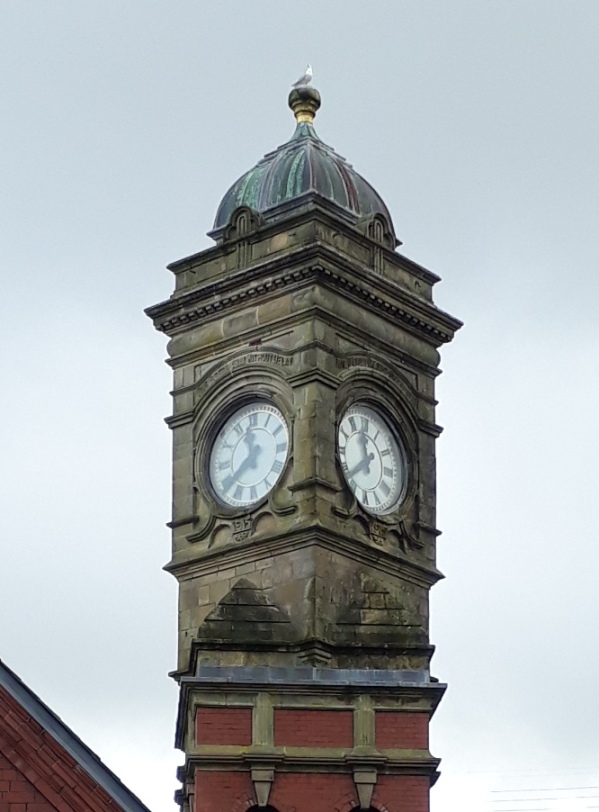
Locate an element on the screen. The height and width of the screenshot is (812, 599). decorative stone is located at coordinates (190, 313), (210, 521), (238, 525), (292, 508), (359, 510), (391, 533).